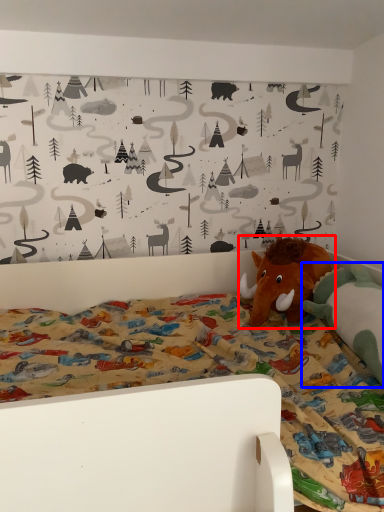
Question: Which object is closer to the camera taking this photo, toy (highlighted by a red box) or toy (highlighted by a blue box)?

Choices:
 (A) toy
 (B) toy

Answer: (B)